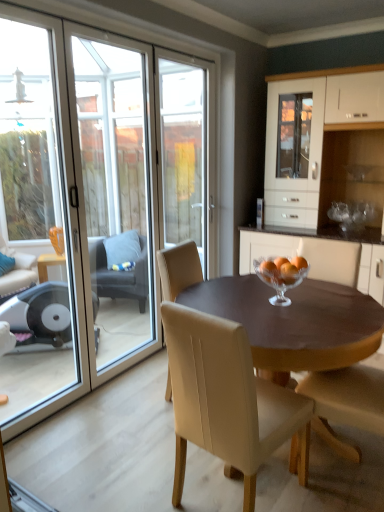
Where is `free space in front of clear glass bowl at center`? The height and width of the screenshot is (512, 384). free space in front of clear glass bowl at center is located at coordinates (295, 314).